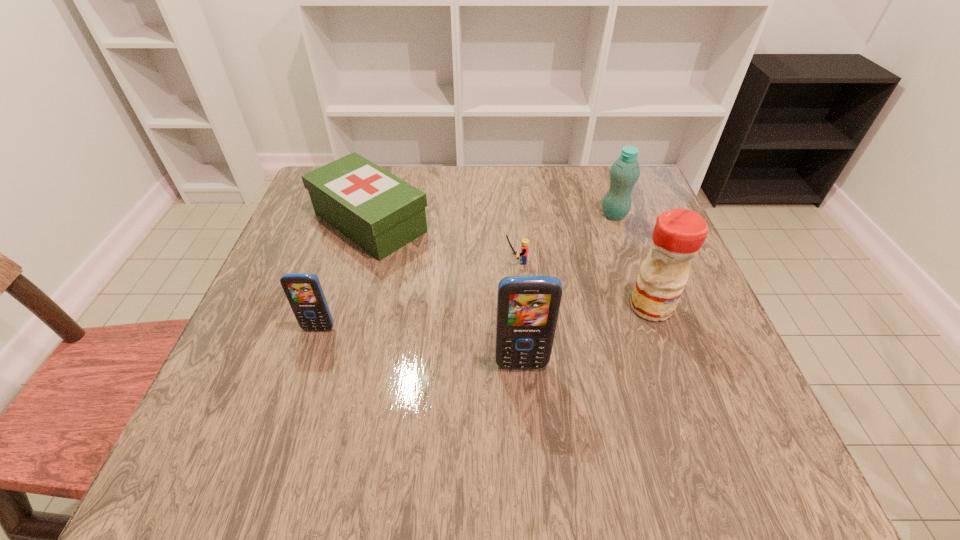
Where is `free point located on the front-facing side of the shortest object`? The image size is (960, 540). free point located on the front-facing side of the shortest object is located at coordinates (362, 261).

Find the location of a particular element. vacant space located on the front-facing side of the shortest object is located at coordinates (326, 261).

Locate an element on the screen. free space located on the right of the fifth tallest object is located at coordinates (560, 222).

Where is `blank area located at the front cap of the third tallest object`? Image resolution: width=960 pixels, height=540 pixels. blank area located at the front cap of the third tallest object is located at coordinates (517, 214).

Where is `vacant region located 0.220m at the front cap of the third tallest object`? The image size is (960, 540). vacant region located 0.220m at the front cap of the third tallest object is located at coordinates (514, 214).

What are the coordinates of `vacant region located 0.330m at the front cap of the third tallest object` in the screenshot? It's located at (470, 214).

Where is `vacant area situated 0.180m on the back of the third nearest object`? The image size is (960, 540). vacant area situated 0.180m on the back of the third nearest object is located at coordinates point(625,236).

Where is `the first-aid kit at the far edge`? The height and width of the screenshot is (540, 960). the first-aid kit at the far edge is located at coordinates (380, 212).

Identify the location of water bottle that is at the far edge. The image size is (960, 540). (625, 171).

Where is `object located in the near edge section of the desktop`? object located in the near edge section of the desktop is located at coordinates (528, 307).